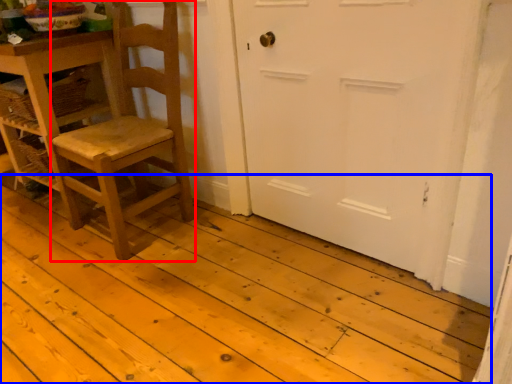
Question: Among these objects, which one is farthest to the camera, chair (highlighted by a red box) or plank (highlighted by a blue box)?

Choices:
 (A) chair
 (B) plank

Answer: (A)